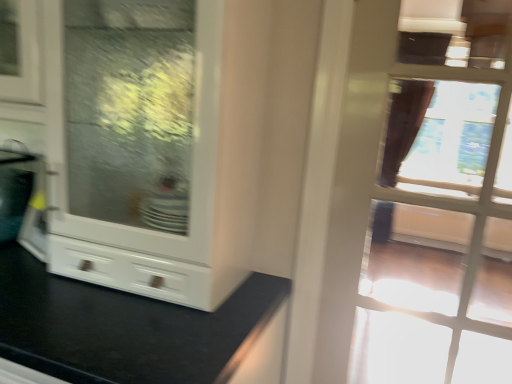
Question: Considering the positions of transparent glass door at upper right and white glossy cabinet at center in the image, is transparent glass door at upper right bigger or smaller than white glossy cabinet at center?

Choices:
 (A) small
 (B) big

Answer: (A)

Question: From the image's perspective, is transparent glass door at upper right positioned above or below white glossy cabinet at center?

Choices:
 (A) above
 (B) below

Answer: (A)

Question: From their relative heights in the image, would you say transparent glass door at upper right is taller or shorter than white glossy cabinet at center?

Choices:
 (A) tall
 (B) short

Answer: (B)

Question: Considering the positions of white glossy cabinet at center and transparent glass door at upper right in the image, is white glossy cabinet at center taller or shorter than transparent glass door at upper right?

Choices:
 (A) short
 (B) tall

Answer: (B)

Question: Is white glossy cabinet at center bigger or smaller than transparent glass door at upper right?

Choices:
 (A) small
 (B) big

Answer: (B)

Question: In terms of width, does white glossy cabinet at center look wider or thinner when compared to transparent glass door at upper right?

Choices:
 (A) thin
 (B) wide

Answer: (B)

Question: From a real-world perspective, is white glossy cabinet at center positioned above or below transparent glass door at upper right?

Choices:
 (A) below
 (B) above

Answer: (A)